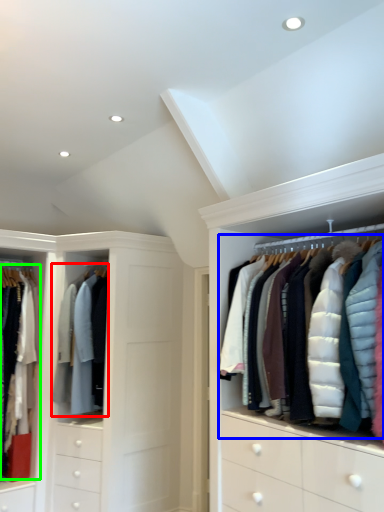
Question: Which object is positioned closest to clothing (highlighted by a red box)? Select from garment (highlighted by a blue box) and clothing (highlighted by a green box).

Choices:
 (A) garment
 (B) clothing

Answer: (B)